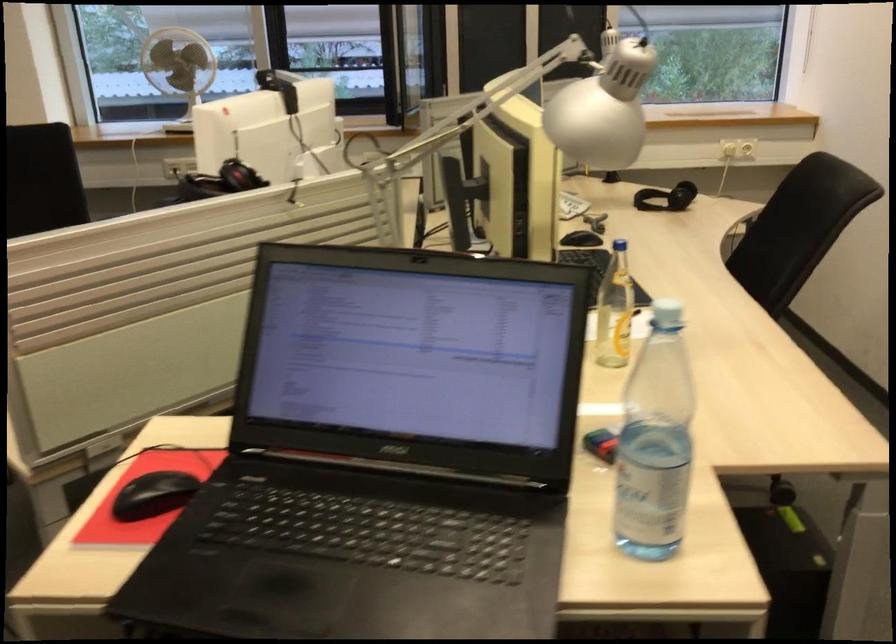
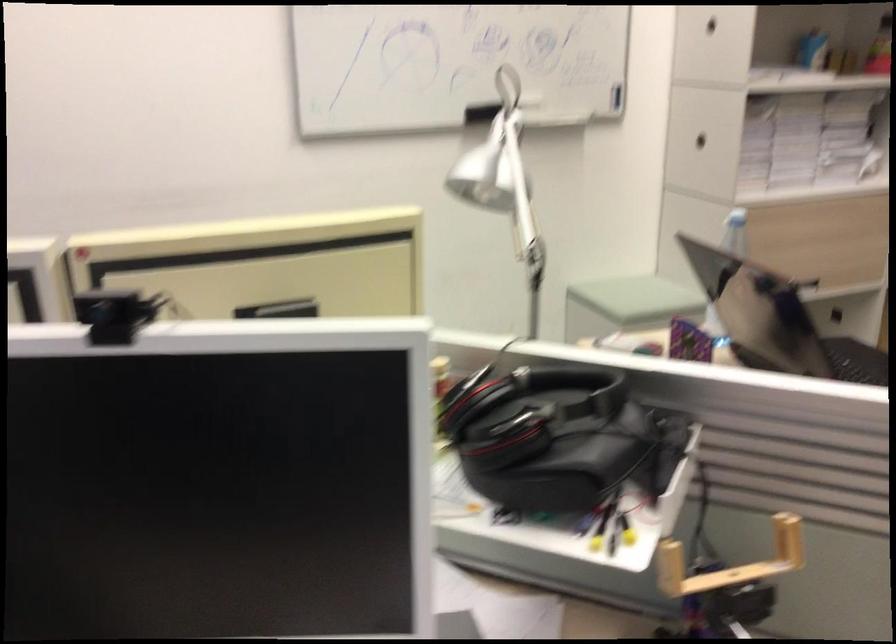
Question: I am providing you with two images of the same scene from different viewpoints. After the viewpoint changes to image2, which objects are now occluded?

Choices:
 (A) black headphones
 (B) white bottle cap
 (C) shiny dispenser lever
 (D) black cabinet handle

Answer: (B)